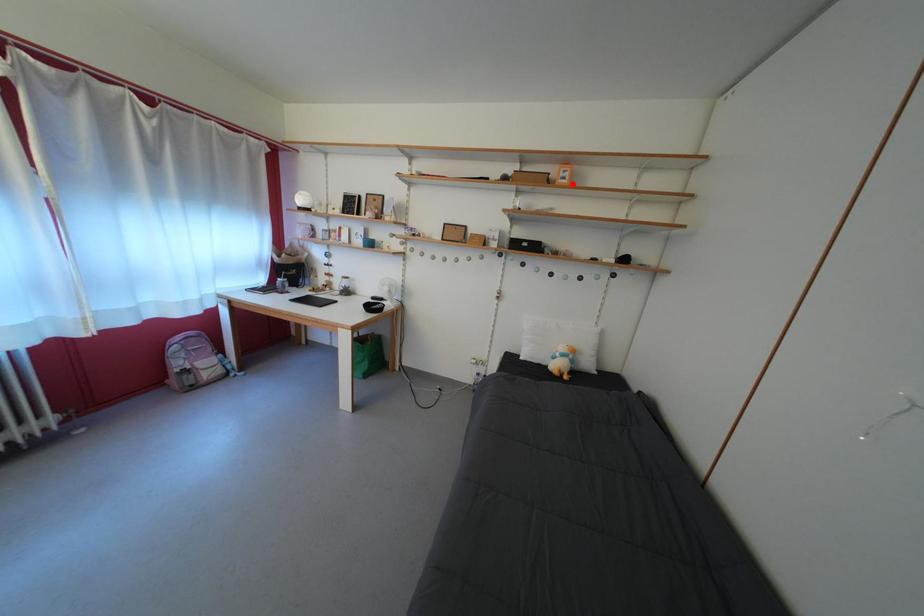
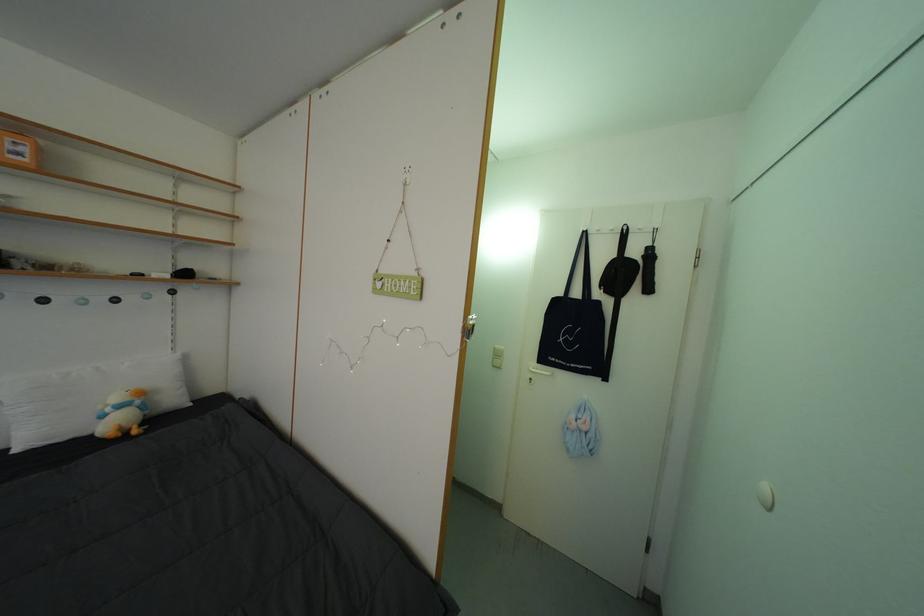
Question: I am providing you with two images of the same scene from different viewpoints. Given a red point in image1, look at the same physical point in image2. Is it:

Choices:
 (A) Closer to the viewpoint
 (B) Farther from the viewpoint

Answer: (B)